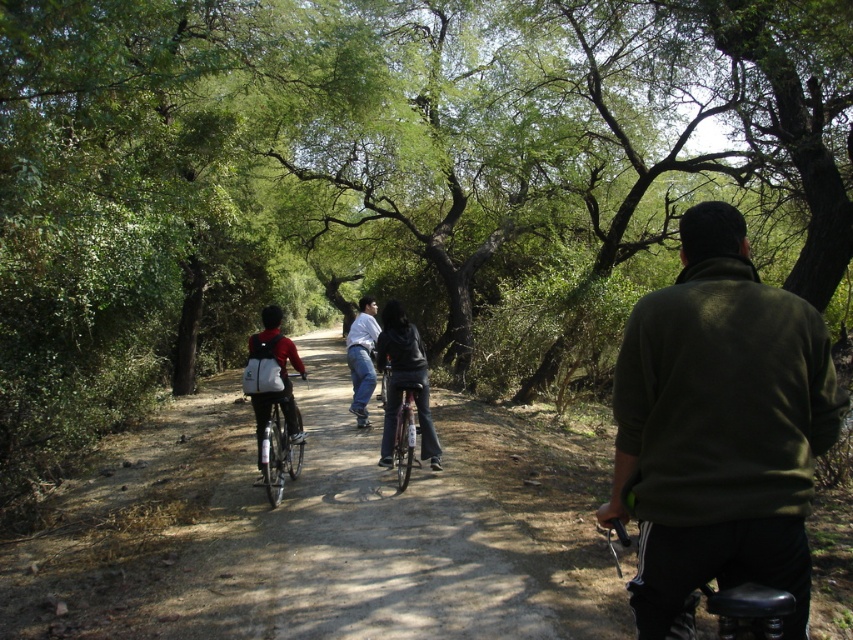
Is matte black jacket at center taller than light blue jeans at center?

No.

Between point (392, 364) and point (360, 419), which one is positioned behind?

Positioned behind is point (360, 419).

Between point (425, 458) and point (363, 332), which one is positioned behind?

Point (363, 332)

Locate an element on the screen. The width and height of the screenshot is (853, 640). matte black jacket at center is located at coordinates (404, 381).

Can you confirm if dirt path at center is thinner than matte black jacket at center?

In fact, dirt path at center might be wider than matte black jacket at center.

Does dirt path at center have a greater width compared to matte black jacket at center?

Indeed, dirt path at center has a greater width compared to matte black jacket at center.

Where is `dirt path at center`? Image resolution: width=853 pixels, height=640 pixels. dirt path at center is located at coordinates (358, 541).

Find the location of a particular element. dirt path at center is located at coordinates (358, 541).

Does olive-green sweater at center come in front of dirt path at center?

That is True.

Which is above, olive-green sweater at center or dirt path at center?

olive-green sweater at center is higher up.

Describe the element at coordinates (718, 428) in the screenshot. I see `olive-green sweater at center` at that location.

Identify the location of olive-green sweater at center. This screenshot has height=640, width=853. (718, 428).